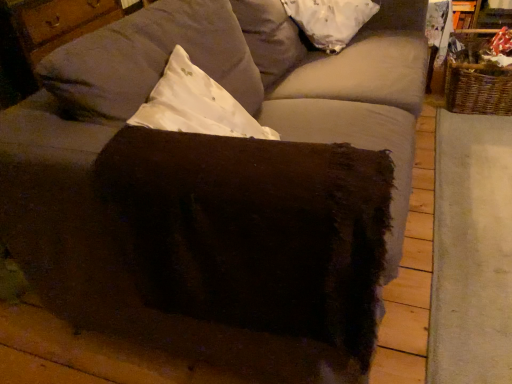
Question: Does woven brown basket at right lie in front of brown fuzzy ottoman at center?

Choices:
 (A) yes
 (B) no

Answer: (B)

Question: Are woven brown basket at right and brown fuzzy ottoman at center far apart?

Choices:
 (A) yes
 (B) no

Answer: (A)

Question: Does woven brown basket at right appear on the right side of brown fuzzy ottoman at center?

Choices:
 (A) no
 (B) yes

Answer: (B)

Question: Considering the relative sizes of woven brown basket at right and brown fuzzy ottoman at center in the image provided, is woven brown basket at right thinner than brown fuzzy ottoman at center?

Choices:
 (A) yes
 (B) no

Answer: (A)

Question: Is the position of woven brown basket at right more distant than that of brown fuzzy ottoman at center?

Choices:
 (A) yes
 (B) no

Answer: (A)

Question: In terms of size, does woven brown basket at right appear bigger or smaller than white fabric pillow at upper center?

Choices:
 (A) small
 (B) big

Answer: (B)

Question: Considering their positions, is woven brown basket at right located in front of or behind white fabric pillow at upper center?

Choices:
 (A) behind
 (B) front

Answer: (A)

Question: Is point (505, 79) positioned closer to the camera than point (348, 36)?

Choices:
 (A) farther
 (B) closer

Answer: (A)

Question: Looking at their shapes, would you say woven brown basket at right is wider or thinner than white fabric pillow at upper center?

Choices:
 (A) thin
 (B) wide

Answer: (B)

Question: Would you say brown fuzzy ottoman at center is to the left or to the right of woven brown basket at right in the picture?

Choices:
 (A) left
 (B) right

Answer: (A)

Question: From their relative heights in the image, would you say brown fuzzy ottoman at center is taller or shorter than woven brown basket at right?

Choices:
 (A) short
 (B) tall

Answer: (A)

Question: Considering their positions, is brown fuzzy ottoman at center located in front of or behind woven brown basket at right?

Choices:
 (A) behind
 (B) front

Answer: (B)

Question: In terms of width, does brown fuzzy ottoman at center look wider or thinner when compared to woven brown basket at right?

Choices:
 (A) wide
 (B) thin

Answer: (A)

Question: Is woven brown basket at right to the left or to the right of brown fuzzy ottoman at center in the image?

Choices:
 (A) right
 (B) left

Answer: (A)

Question: Is woven brown basket at right inside the boundaries of brown fuzzy ottoman at center, or outside?

Choices:
 (A) inside
 (B) outside

Answer: (B)